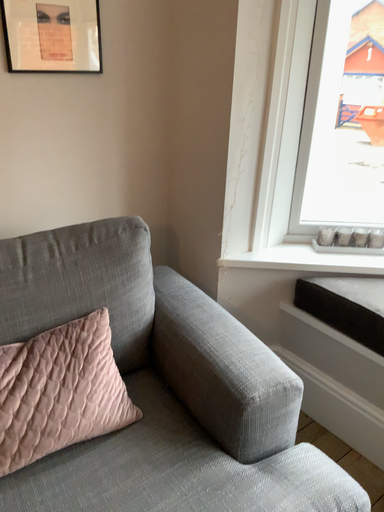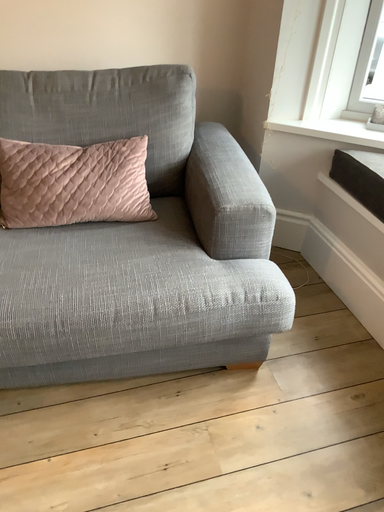
Question: How did the camera likely rotate when shooting the video?

Choices:
 (A) rotated right
 (B) rotated left

Answer: (B)